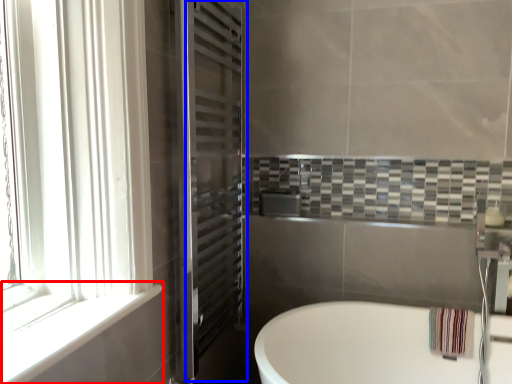
Question: Among these objects, which one is farthest to the camera, window sill (highlighted by a red box) or screen door (highlighted by a blue box)?

Choices:
 (A) window sill
 (B) screen door

Answer: (B)